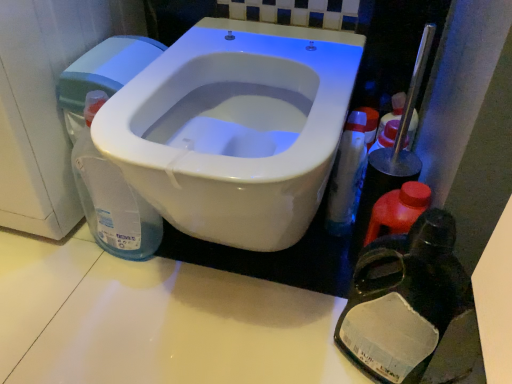
You are a GUI agent. You are given a task and a screenshot of the screen. Output one action in this format:
    pyautogui.click(x=<x>, y=<y>)
    Task: Click on the white glossy bidet at center
    The width and height of the screenshot is (512, 384).
    Given the screenshot: What is the action you would take?
    pyautogui.click(x=234, y=129)

Measure the distance between white glossy bidet at center and camera.

white glossy bidet at center is 18.68 inches from camera.

What do you see at coordinates (234, 129) in the screenshot? I see `white glossy bidet at center` at bounding box center [234, 129].

Identify the location of white glossy bidet at center. (234, 129).